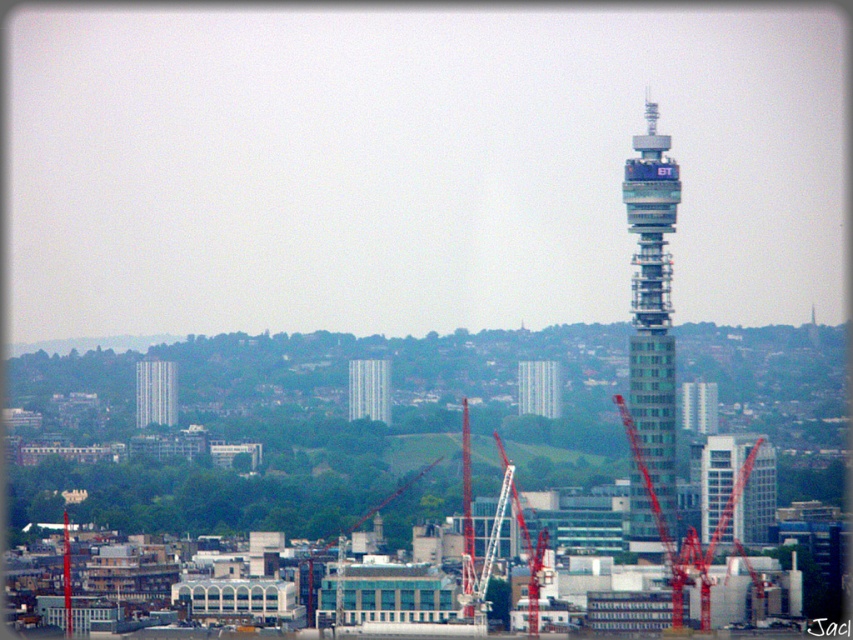
Find the location of a particular element. The width and height of the screenshot is (853, 640). red metal crane at center is located at coordinates (686, 531).

Is point (698, 552) positioned before point (712, 413)?

No, it is not.

Is point (718, 538) farther from viewer compared to point (688, 428)?

Yes, it is.

This screenshot has width=853, height=640. In order to click on red metal crane at center in this screenshot , I will do `click(686, 531)`.

Is white glass building at center behind metallic silver tower at center?

Yes, it is behind metallic silver tower at center.

Between point (144, 422) and point (548, 362), which one is positioned behind?

Point (144, 422)

Between point (148, 406) and point (550, 417), which one is positioned in front?

Point (550, 417) is more forward.

Identify the location of white glass building at center. (155, 392).

Can you confirm if red metal crane at center is taller than metallic silver tower at center?

Correct, red metal crane at center is much taller as metallic silver tower at center.

What do you see at coordinates (686, 531) in the screenshot? I see `red metal crane at center` at bounding box center [686, 531].

Who is more forward, (699, 545) or (529, 412)?

Positioned in front is point (529, 412).

Locate an element on the screen. The height and width of the screenshot is (640, 853). red metal crane at center is located at coordinates (686, 531).